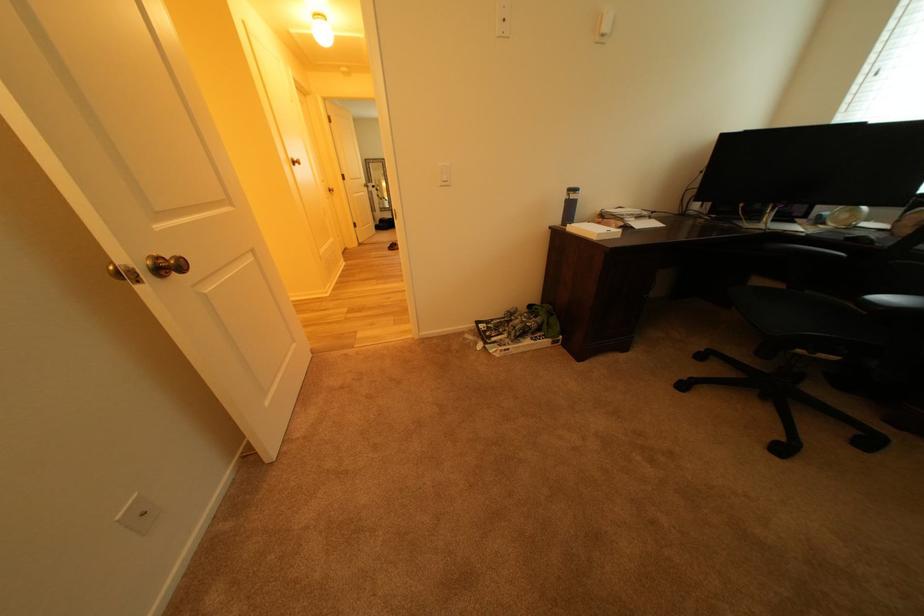
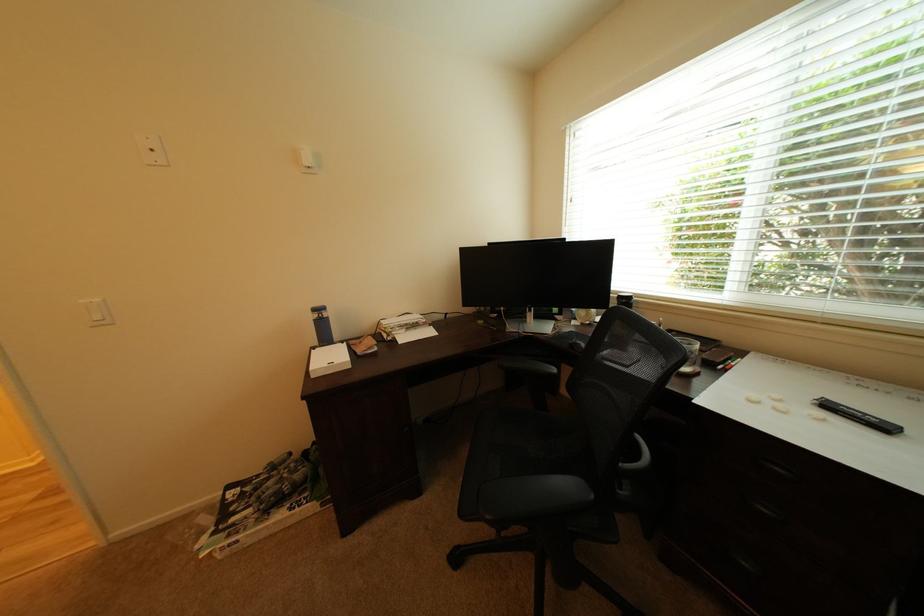
Question: The images are taken continuously from a first-person perspective. In which direction are you moving?

Choices:
 (A) Left
 (B) Right
 (C) Forward
 (D) Backward

Answer: (B)